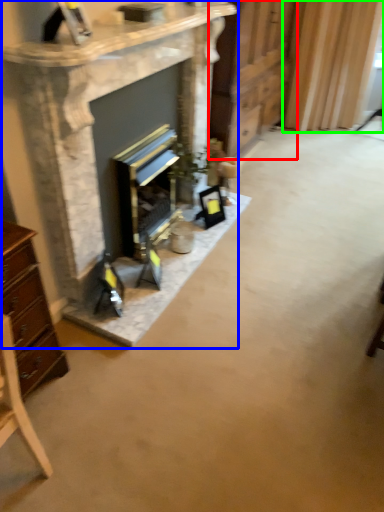
Question: Which object is positioned farthest from dresser (highlighted by a red box)? Select from fireplace (highlighted by a blue box) and curtain (highlighted by a green box).

Choices:
 (A) fireplace
 (B) curtain

Answer: (A)